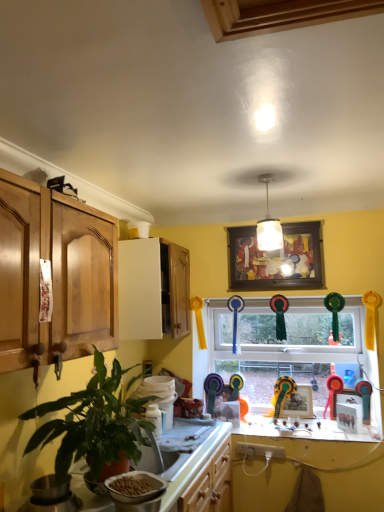
Question: Can you confirm if matte wooden picture frame at center, which appears as the 2th picture frame when viewed from the front, is positioned to the right of yellow matte counter top at lower center?

Choices:
 (A) yes
 (B) no

Answer: (A)

Question: Is yellow matte counter top at lower center inside matte wooden picture frame at center, which appears as the 2th picture frame when viewed from the front?

Choices:
 (A) no
 (B) yes

Answer: (A)

Question: Does matte wooden picture frame at center, marked as the 1th picture frame in a back-to-front arrangement, have a greater width compared to yellow matte counter top at lower center?

Choices:
 (A) yes
 (B) no

Answer: (B)

Question: Is matte wooden picture frame at center, which appears as the 2th picture frame when viewed from the front, positioned beyond the bounds of yellow matte counter top at lower center?

Choices:
 (A) yes
 (B) no

Answer: (A)

Question: Is the position of matte wooden picture frame at center, marked as the 1th picture frame in a back-to-front arrangement, less distant than that of yellow matte counter top at lower center?

Choices:
 (A) no
 (B) yes

Answer: (A)

Question: Are matte wooden picture frame at center, which appears as the 2th picture frame when viewed from the front, and yellow matte counter top at lower center located far from each other?

Choices:
 (A) yes
 (B) no

Answer: (B)

Question: Considering the relative positions of metallic gold trophy at window and white plastic bowl at lower center in the image provided, is metallic gold trophy at window to the right of white plastic bowl at lower center from the viewer's perspective?

Choices:
 (A) no
 (B) yes

Answer: (B)

Question: Does metallic gold trophy at window have a lesser width compared to white plastic bowl at lower center?

Choices:
 (A) yes
 (B) no

Answer: (A)

Question: Are metallic gold trophy at window and white plastic bowl at lower center located far from each other?

Choices:
 (A) yes
 (B) no

Answer: (A)

Question: Is metallic gold trophy at window next to white plastic bowl at lower center and touching it?

Choices:
 (A) yes
 (B) no

Answer: (B)

Question: Can we say metallic gold trophy at window lies outside white plastic bowl at lower center?

Choices:
 (A) yes
 (B) no

Answer: (A)

Question: From the image's perspective, is metallic gold trophy at window over white plastic bowl at lower center?

Choices:
 (A) yes
 (B) no

Answer: (B)

Question: Is metallic gold trophy at window at the back of wooden framed artwork at center, positioned as the second picture frame in bottom-to-top order?

Choices:
 (A) no
 (B) yes

Answer: (A)